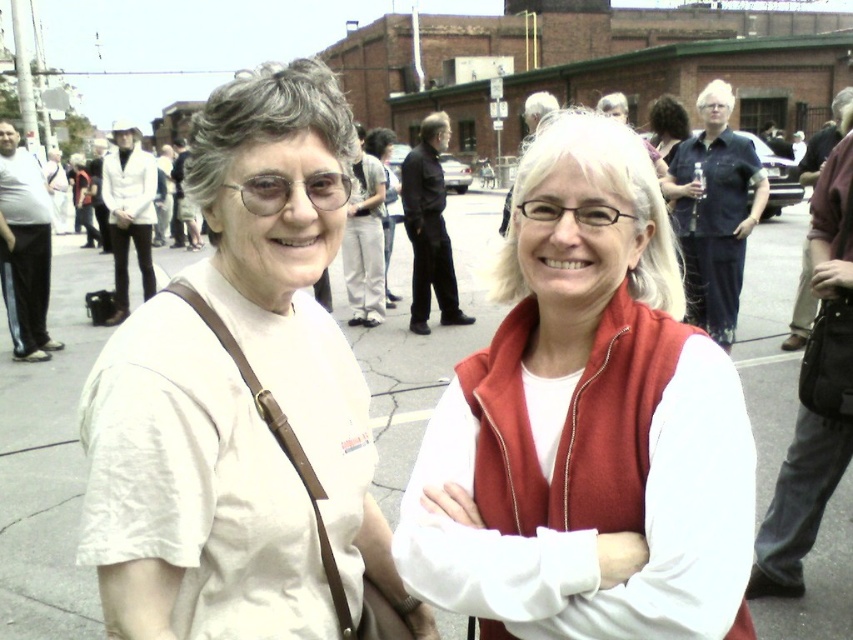
Looking at this image, you are standing in the middle of the street and want to walk to the gray asphalt pavement at center. Since you are at the starting point, what direction should you move to reach it?

Since the gray asphalt pavement at center is located at point (47, 467), you should move forward in the direction of the gray asphalt pavement at center to reach it.

You are a photographer at the event and want to capture both the matte red vest at center and the white matte shirt at left in a single frame. Which object should you focus on first to ensure both are in the frame?

The matte red vest at center is smaller than the white matte shirt at left, so focus on the white matte shirt at left first to ensure both fit in the frame.